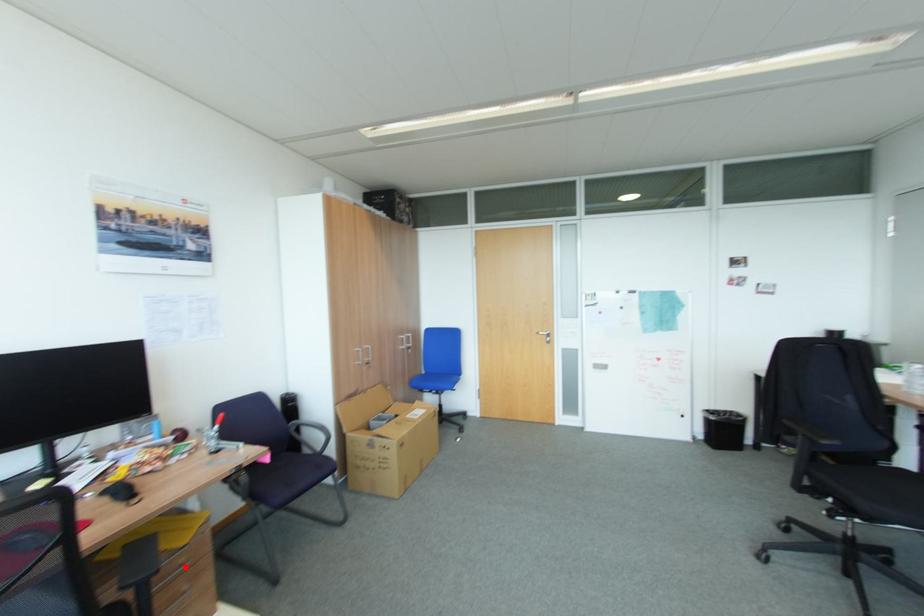
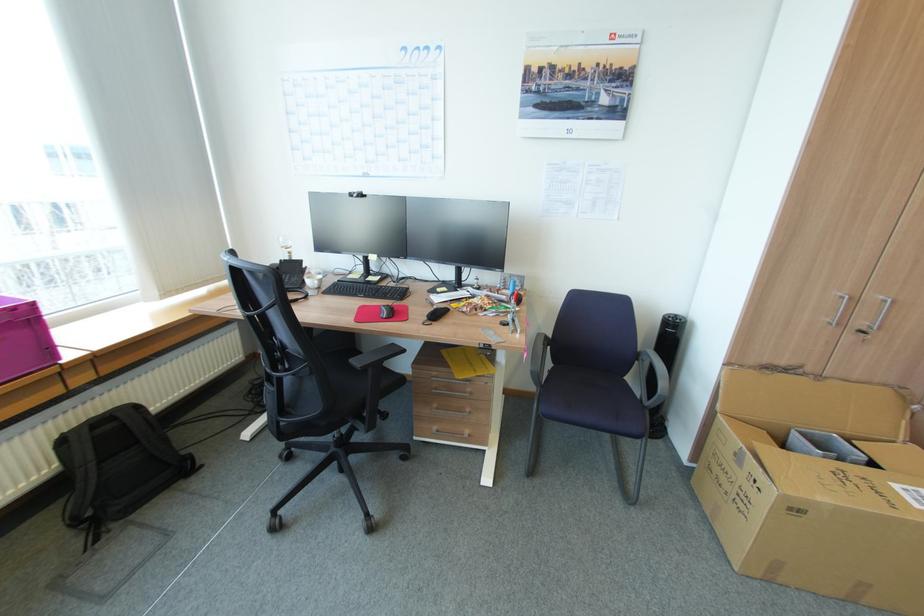
The point at the highlighted location is marked in the first image. Where is the corresponding point in the second image?

(469, 392)